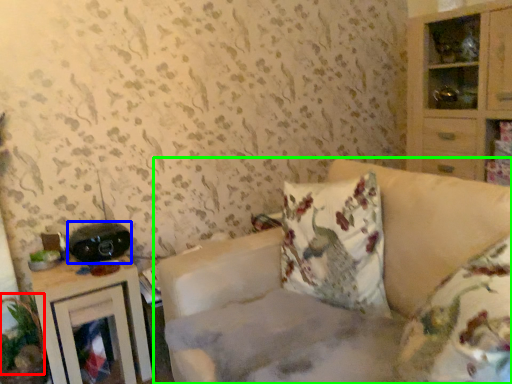
Question: Which is nearer to the plant (highlighted by a red box)? stereo (highlighted by a blue box) or studio couch (highlighted by a green box).

Choices:
 (A) stereo
 (B) studio couch

Answer: (A)